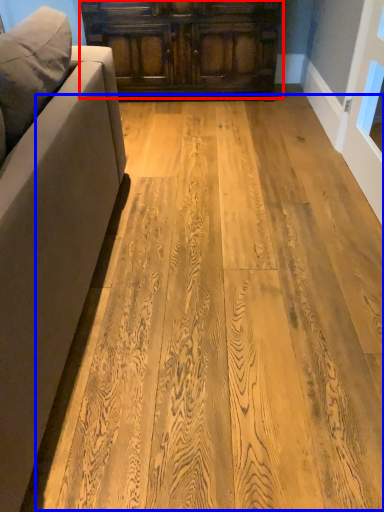
Question: Which point is closer to the camera, cabinetry (highlighted by a red box) or plywood (highlighted by a blue box)?

Choices:
 (A) cabinetry
 (B) plywood

Answer: (B)